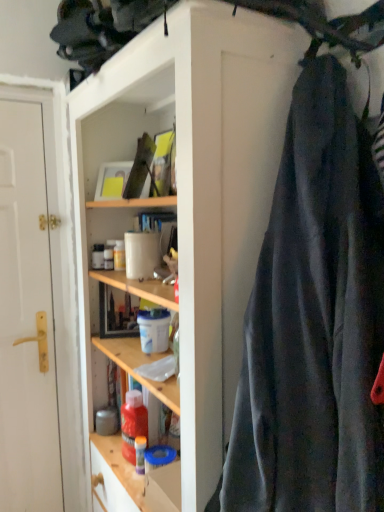
Question: Is dark gray fabric at right to the right of white matte door at left from the viewer's perspective?

Choices:
 (A) no
 (B) yes

Answer: (B)

Question: Considering the relative sizes of dark gray fabric at right and white matte door at left in the image provided, is dark gray fabric at right wider than white matte door at left?

Choices:
 (A) no
 (B) yes

Answer: (B)

Question: Is dark gray fabric at right aimed at white matte door at left?

Choices:
 (A) yes
 (B) no

Answer: (B)

Question: Is dark gray fabric at right surrounding white matte door at left?

Choices:
 (A) yes
 (B) no

Answer: (B)

Question: Is dark gray fabric at right further to camera compared to white matte door at left?

Choices:
 (A) yes
 (B) no

Answer: (B)

Question: From their relative heights in the image, would you say wooden shelves at center is taller or shorter than white matte door at left?

Choices:
 (A) short
 (B) tall

Answer: (A)

Question: In terms of width, does wooden shelves at center look wider or thinner when compared to white matte door at left?

Choices:
 (A) wide
 (B) thin

Answer: (A)

Question: Considering their positions, is wooden shelves at center located in front of or behind white matte door at left?

Choices:
 (A) front
 (B) behind

Answer: (A)

Question: Is wooden shelves at center situated inside white matte door at left or outside?

Choices:
 (A) outside
 (B) inside

Answer: (A)

Question: Is white matte door at left in front of or behind dark gray fabric at right in the image?

Choices:
 (A) front
 (B) behind

Answer: (B)

Question: In terms of size, does white matte door at left appear bigger or smaller than dark gray fabric at right?

Choices:
 (A) big
 (B) small

Answer: (B)

Question: Does point (18, 246) appear closer or farther from the camera than point (354, 298)?

Choices:
 (A) farther
 (B) closer

Answer: (A)

Question: From a real-world perspective, is white matte door at left physically located above or below dark gray fabric at right?

Choices:
 (A) below
 (B) above

Answer: (A)

Question: Considering the positions of dark gray fabric at right and wooden shelves at center in the image, is dark gray fabric at right taller or shorter than wooden shelves at center?

Choices:
 (A) short
 (B) tall

Answer: (A)

Question: Is dark gray fabric at right bigger or smaller than wooden shelves at center?

Choices:
 (A) small
 (B) big

Answer: (A)